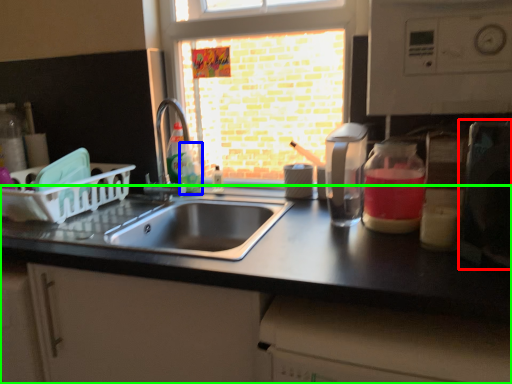
Question: Based on their relative distances, which object is nearer to appliance (highlighted by a red box)? Choose from bottle (highlighted by a blue box) and countertop (highlighted by a green box).

Choices:
 (A) bottle
 (B) countertop

Answer: (B)